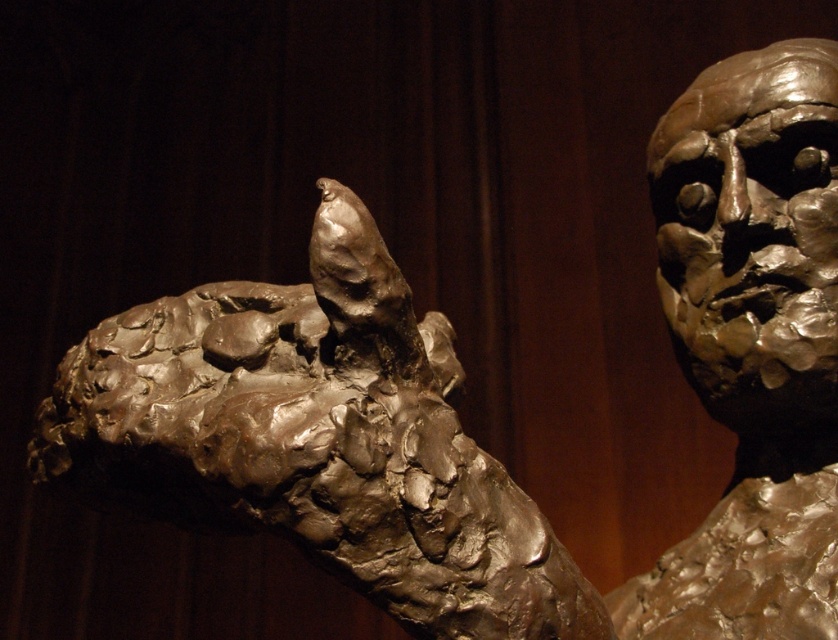
Does matte bronze sculpture at center have a greater width compared to bronze textured bust at right?

Correct, the width of matte bronze sculpture at center exceeds that of bronze textured bust at right.

Does matte bronze sculpture at center lie in front of bronze textured bust at right?

Yes, matte bronze sculpture at center is in front of bronze textured bust at right.

Looking at this image, who is more forward, (x=65, y=429) or (x=681, y=577)?

Point (x=65, y=429) is in front.

Where is `matte bronze sculpture at center`? The width and height of the screenshot is (838, 640). matte bronze sculpture at center is located at coordinates (314, 440).